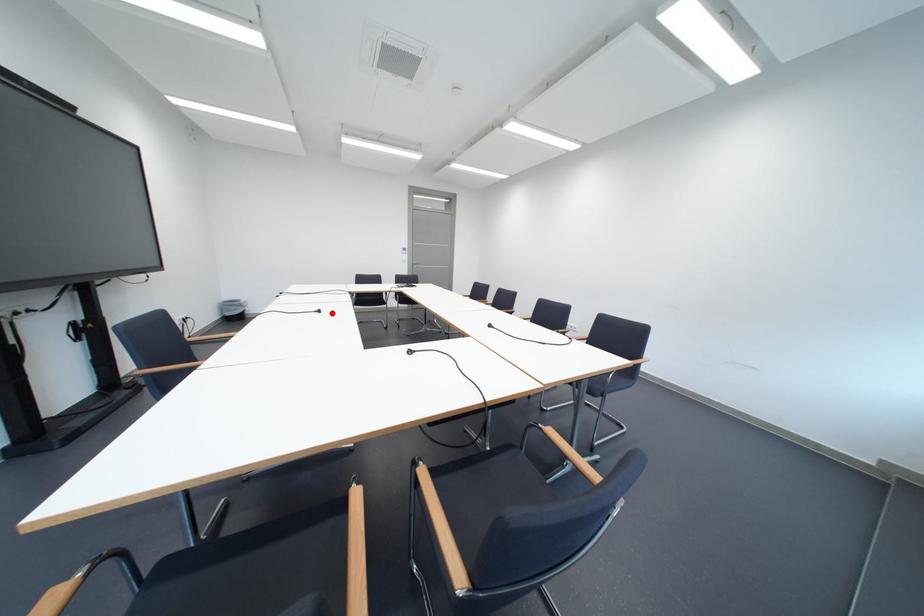
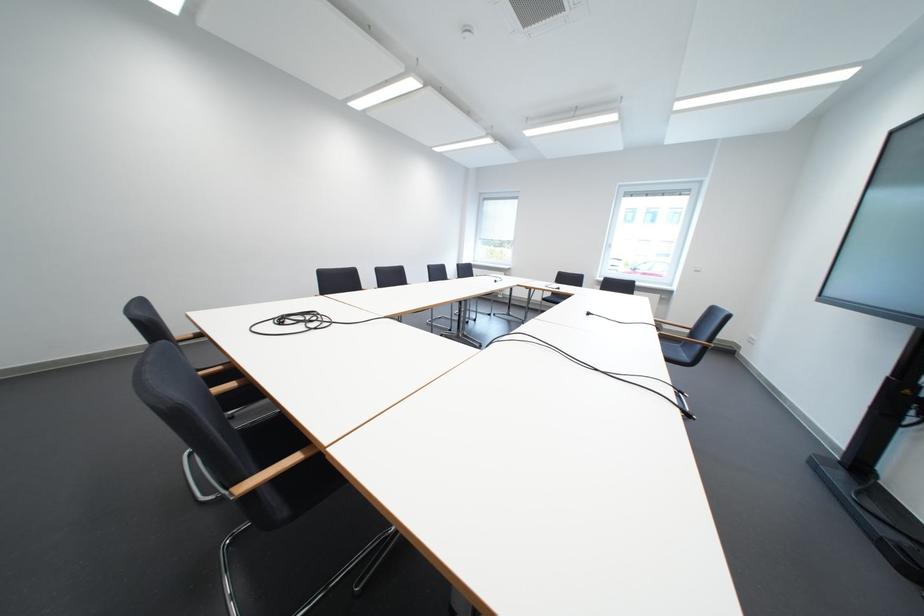
Question: A red point is marked in image1. In image2, is the corresponding 3D point closer to the camera or farther? Reply with the corresponding letter.

Choices:
 (A) The corresponding 3D point is closer.
 (B) The corresponding 3D point is farther.

Answer: (A)